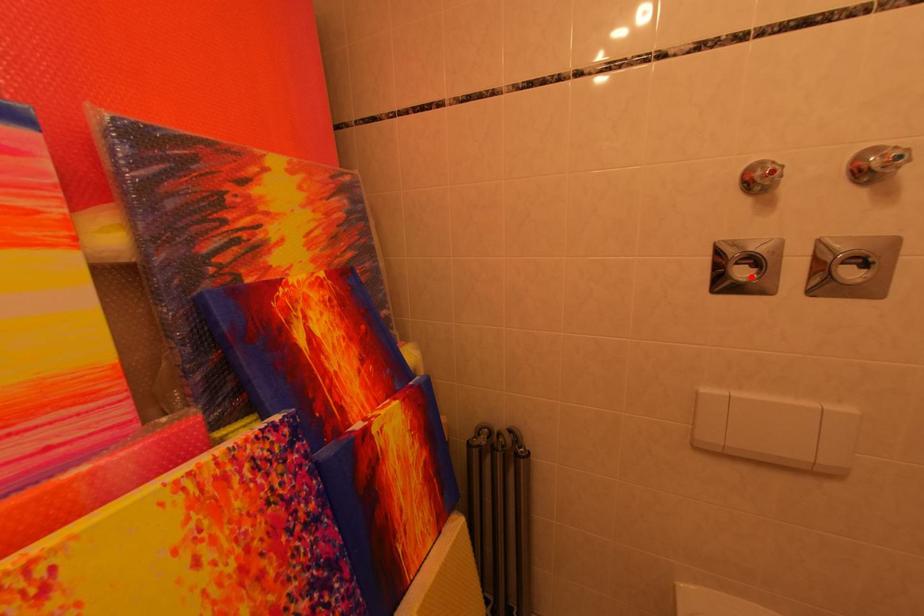
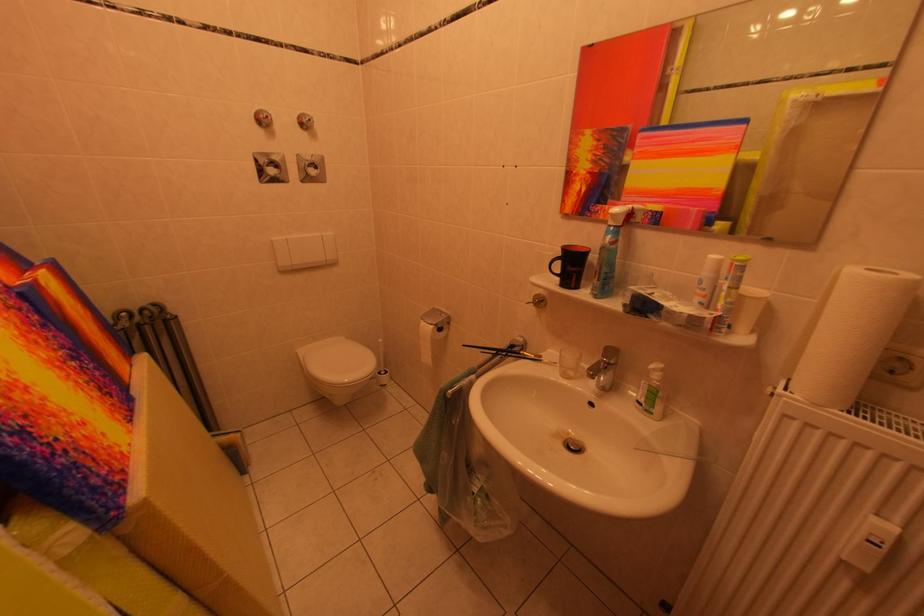
The point at the highlighted location is marked in the first image. Where is the corresponding point in the second image?

(282, 175)